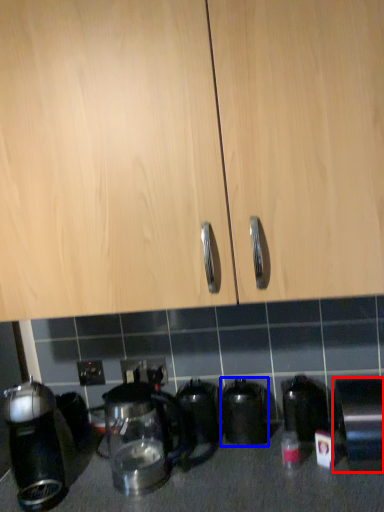
Question: Which of the following is the farthest to the observer, kitchen appliance (highlighted by a red box) or kitchen appliance (highlighted by a blue box)?

Choices:
 (A) kitchen appliance
 (B) kitchen appliance

Answer: (B)